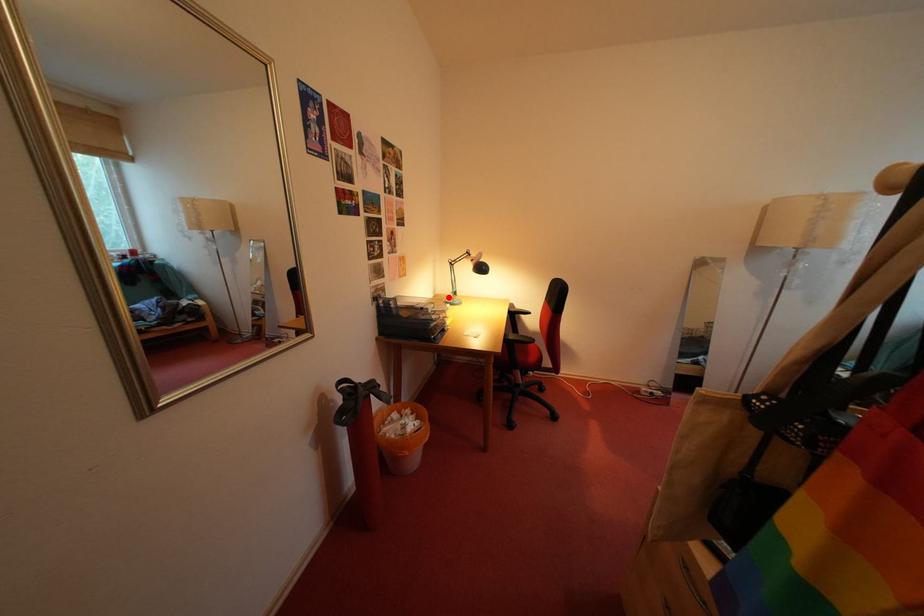
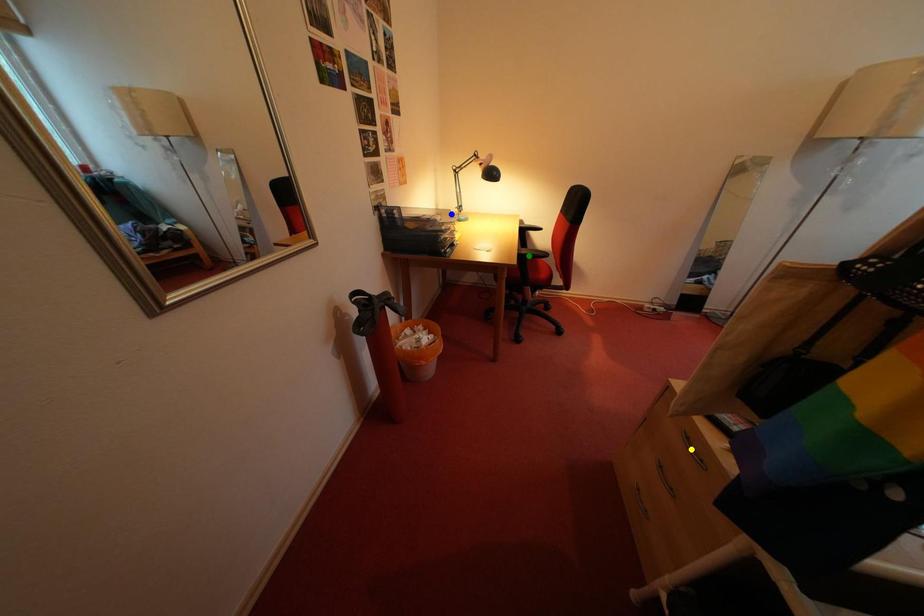
Question: I am providing you with two images of the same scene from different viewpoints. A red point is marked on the first image. You are given multiple points on the second image. Can you choose the point in image 2 that corresponds to the point in image 1?

Choices:
 (A) green point
 (B) blue point
 (C) yellow point

Answer: (B)